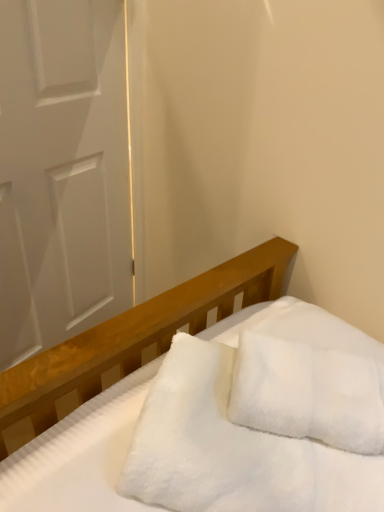
Question: Is white matte door at left closer to camera compared to white fluffy pillow at center?

Choices:
 (A) yes
 (B) no

Answer: (B)

Question: Is white matte door at left at the right side of white fluffy pillow at center?

Choices:
 (A) yes
 (B) no

Answer: (B)

Question: Can you confirm if white matte door at left is wider than white fluffy pillow at center?

Choices:
 (A) no
 (B) yes

Answer: (A)

Question: Considering the relative sizes of white matte door at left and white fluffy pillow at center in the image provided, is white matte door at left thinner than white fluffy pillow at center?

Choices:
 (A) no
 (B) yes

Answer: (B)

Question: Is white matte door at left completely or partially outside of white fluffy pillow at center?

Choices:
 (A) yes
 (B) no

Answer: (A)

Question: Is white fluffy pillow at center inside white matte door at left?

Choices:
 (A) no
 (B) yes

Answer: (A)

Question: Does white matte door at left come behind white fluffy blanket at center?

Choices:
 (A) no
 (B) yes

Answer: (B)

Question: Can you confirm if white matte door at left is thinner than white fluffy blanket at center?

Choices:
 (A) no
 (B) yes

Answer: (B)

Question: From the image's perspective, is white matte door at left located above white fluffy blanket at center?

Choices:
 (A) yes
 (B) no

Answer: (A)

Question: Considering the relative positions of white matte door at left and white fluffy blanket at center in the image provided, is white matte door at left to the left of white fluffy blanket at center from the viewer's perspective?

Choices:
 (A) yes
 (B) no

Answer: (A)

Question: Can you confirm if white matte door at left is taller than white fluffy blanket at center?

Choices:
 (A) no
 (B) yes

Answer: (B)

Question: Can white fluffy blanket at center be found inside white matte door at left?

Choices:
 (A) yes
 (B) no

Answer: (B)

Question: Is white fluffy pillow at center to the right of white matte door at left from the viewer's perspective?

Choices:
 (A) no
 (B) yes

Answer: (B)